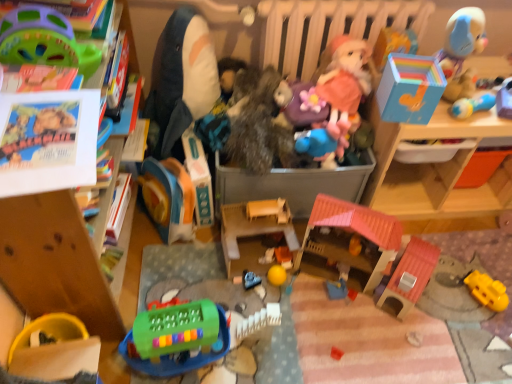
The height and width of the screenshot is (384, 512). I want to click on free space between yellow plastic blocks at lower right, acting as the fifteenth toy starting from the left, and smooth blue car at center, the eleventh toy in the right-to-left sequence, so click(x=376, y=296).